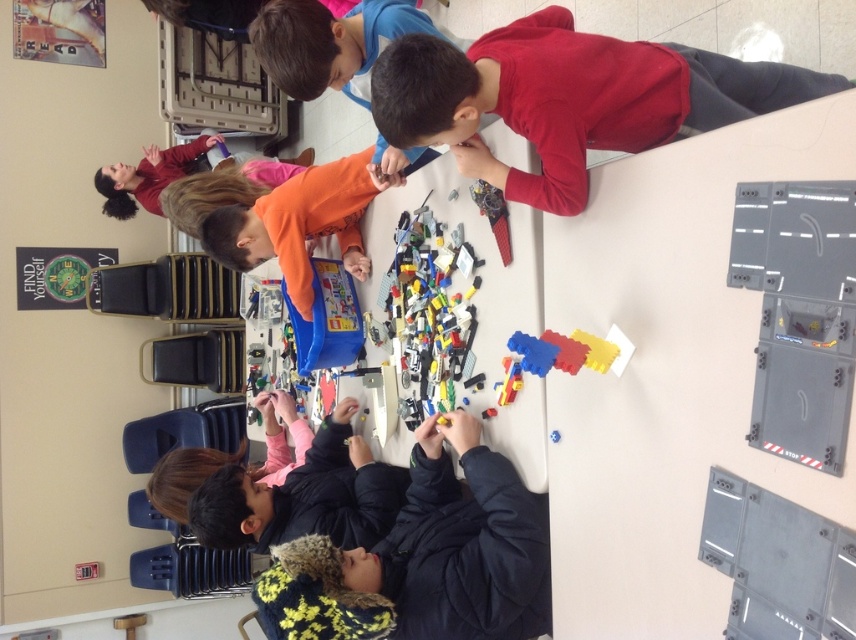
Question: Which point is closer to the camera?

Choices:
 (A) red matte shirt at upper right
 (B) orange matte shirt at upper center
 (C) dark blue jacket at lower center

Answer: (A)

Question: From the image, what is the correct spatial relationship of bright plastic lego pieces at center in relation to orange matte shirt at upper center?

Choices:
 (A) left
 (B) right

Answer: (B)

Question: Based on their relative distances, which object is nearer to the bright plastic lego pieces at center?

Choices:
 (A) dark blue jacket at lower center
 (B) red matte shirt at upper right

Answer: (A)

Question: In this image, where is red matte shirt at upper right located relative to orange matte shirt at upper center?

Choices:
 (A) below
 (B) above

Answer: (A)

Question: Does bright plastic lego pieces at center appear under orange matte shirt at upper center?

Choices:
 (A) yes
 (B) no

Answer: (A)

Question: Which point appears closest to the camera in this image?

Choices:
 (A) (387, 305)
 (B) (395, 45)

Answer: (B)